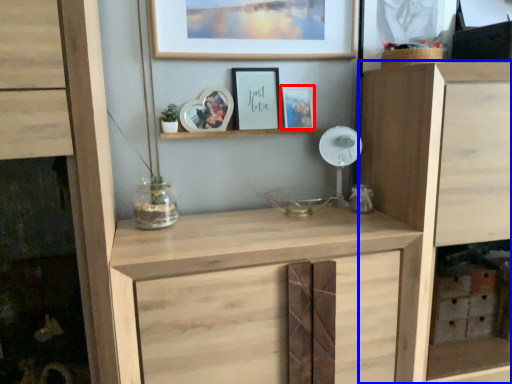
Question: Which object is further to the camera taking this photo, picture frame (highlighted by a red box) or cupboard (highlighted by a blue box)?

Choices:
 (A) picture frame
 (B) cupboard

Answer: (A)